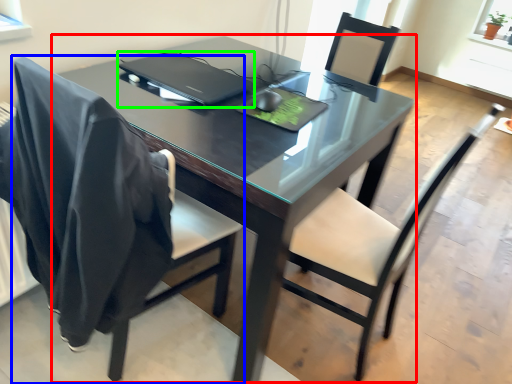
Question: Which is nearer to the table (highlighted by a red box)? chair (highlighted by a blue box) or laptop (highlighted by a green box).

Choices:
 (A) chair
 (B) laptop

Answer: (B)